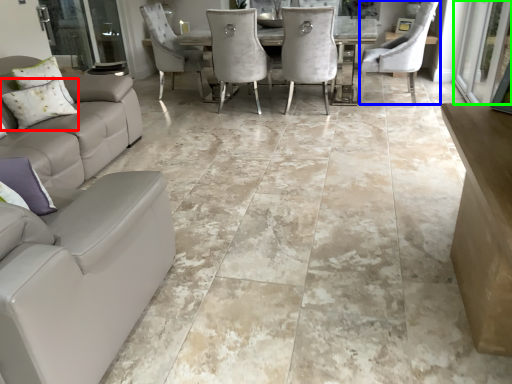
Question: Considering the real-world distances, which object is farthest from pillow (highlighted by a red box)? chair (highlighted by a blue box) or screen door (highlighted by a green box)?

Choices:
 (A) chair
 (B) screen door

Answer: (B)